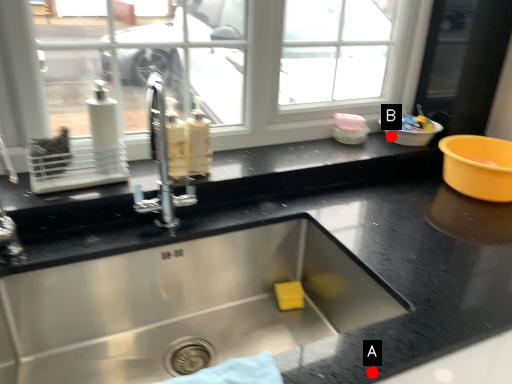
Question: Two points are circled on the image, labeled by A and B beside each circle. Which point is closer to the camera?

Choices:
 (A) A is closer
 (B) B is closer

Answer: (A)